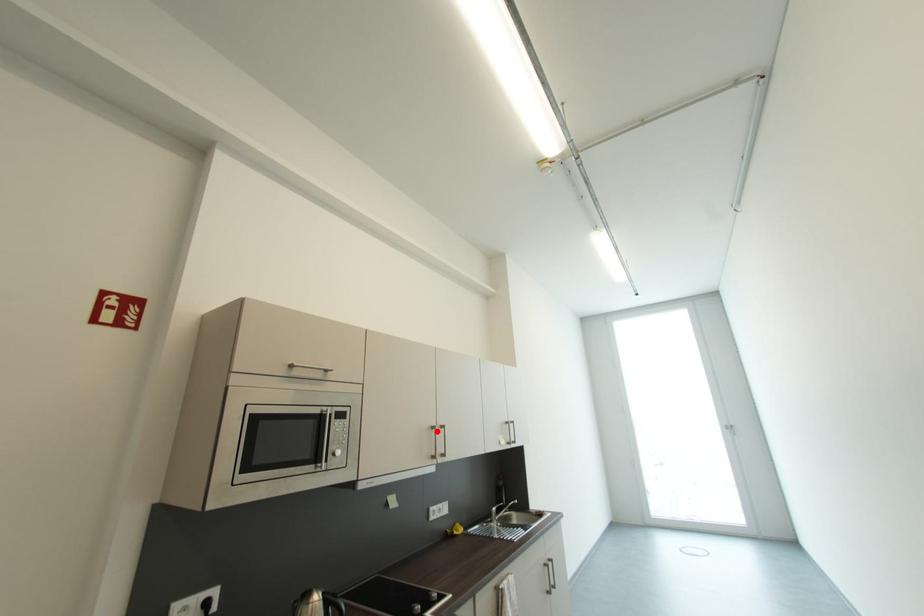
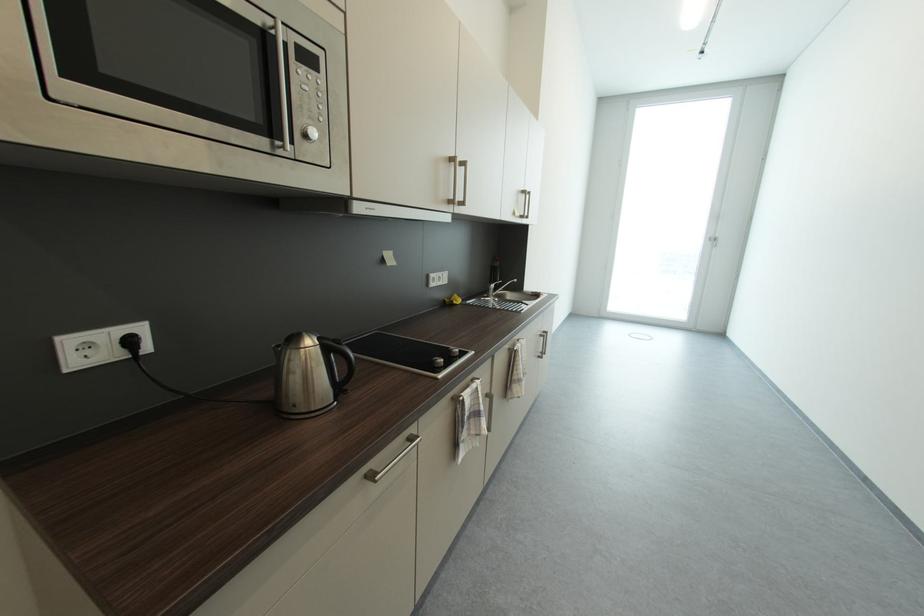
Question: I am providing you with two images of the same scene from different viewpoints. In image1, a red point is highlighted. Considering the same 3D point in image2, which of the following is correct?

Choices:
 (A) It is closer
 (B) It is farther

Answer: (A)